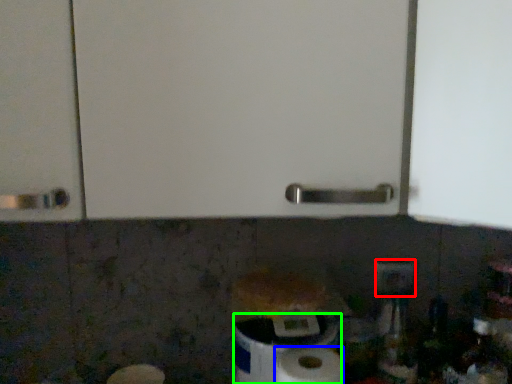
Question: Which object is the closest to the electric outlet (highlighted by a red box)? Choose among these: paper towel (highlighted by a blue box) or toilet paper (highlighted by a green box).

Choices:
 (A) paper towel
 (B) toilet paper

Answer: (B)